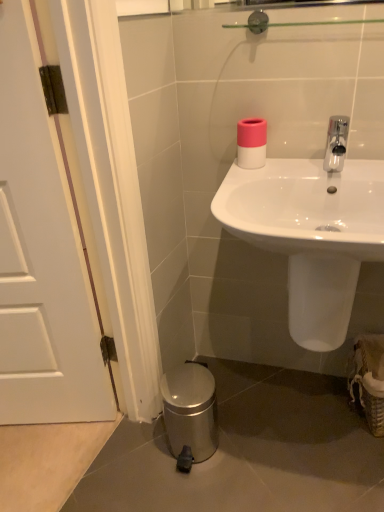
This screenshot has width=384, height=512. Identify the location of free space to the right of pink matte toilet paper at upper center. (310, 163).